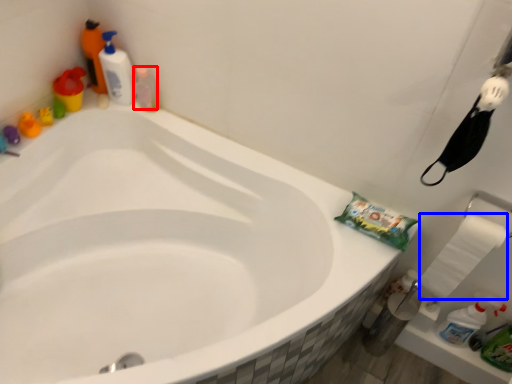
Question: Which object is further to the camera taking this photo, cleaning product (highlighted by a red box) or toilet paper (highlighted by a blue box)?

Choices:
 (A) cleaning product
 (B) toilet paper

Answer: (A)